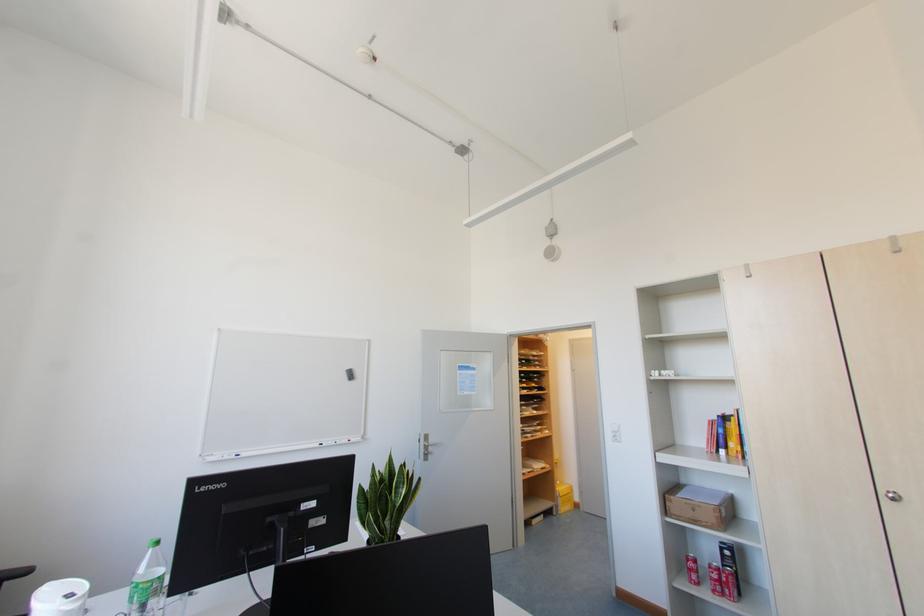
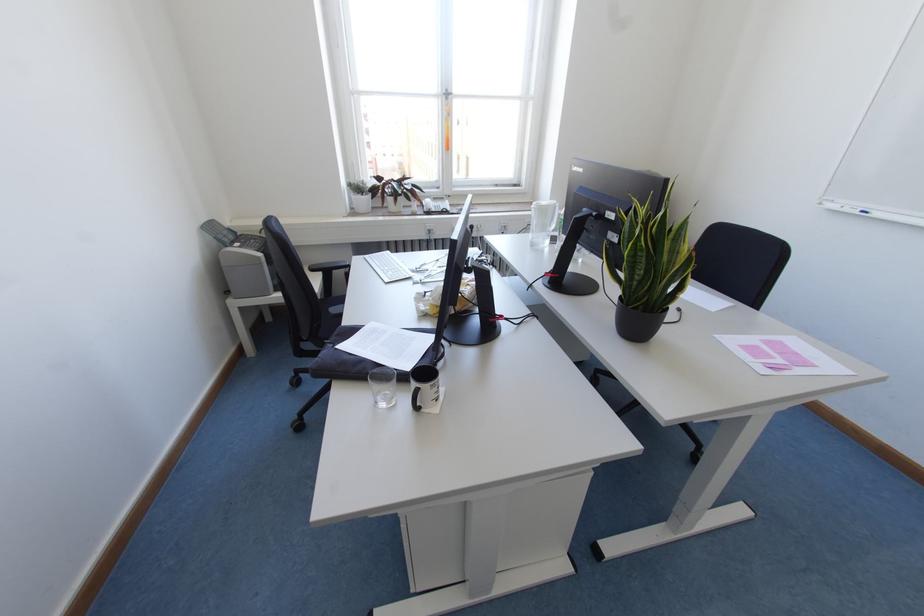
In the second image, find the point that corresponds to point 237,455 in the first image.

(864, 213)